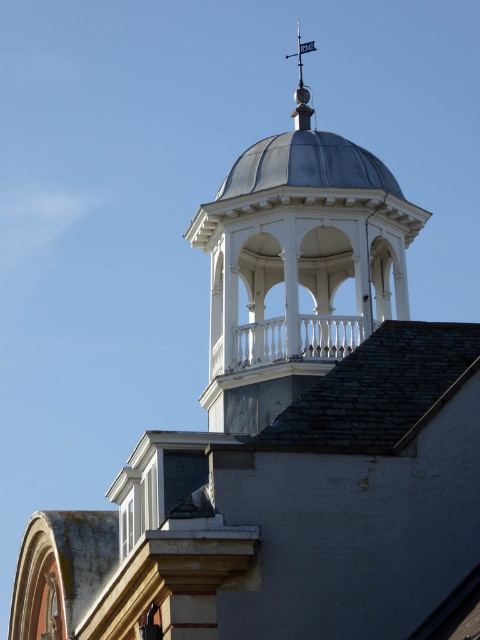
Who is positioned more to the right, gray slate roof at upper center or polished silver spire at upper center?

polished silver spire at upper center is more to the right.

This screenshot has width=480, height=640. In order to click on gray slate roof at upper center in this screenshot , I will do tap(379, 390).

Is white wood bell tower at upper center closer to camera compared to gray slate roof at upper center?

No.

Is white wood bell tower at upper center wider than gray slate roof at upper center?

Indeed, white wood bell tower at upper center has a greater width compared to gray slate roof at upper center.

I want to click on white wood bell tower at upper center, so click(297, 268).

This screenshot has height=640, width=480. Identify the location of white wood bell tower at upper center. (297, 268).

Can you confirm if white wood bell tower at upper center is positioned to the right of polished silver spire at upper center?

Incorrect, white wood bell tower at upper center is not on the right side of polished silver spire at upper center.

Which of these two, white wood bell tower at upper center or polished silver spire at upper center, stands shorter?

With less height is white wood bell tower at upper center.

Is point (219, 314) farther from viewer compared to point (309, 99)?

No, it is in front of (309, 99).

Locate an element on the screen. The width and height of the screenshot is (480, 640). white wood bell tower at upper center is located at coordinates (297, 268).